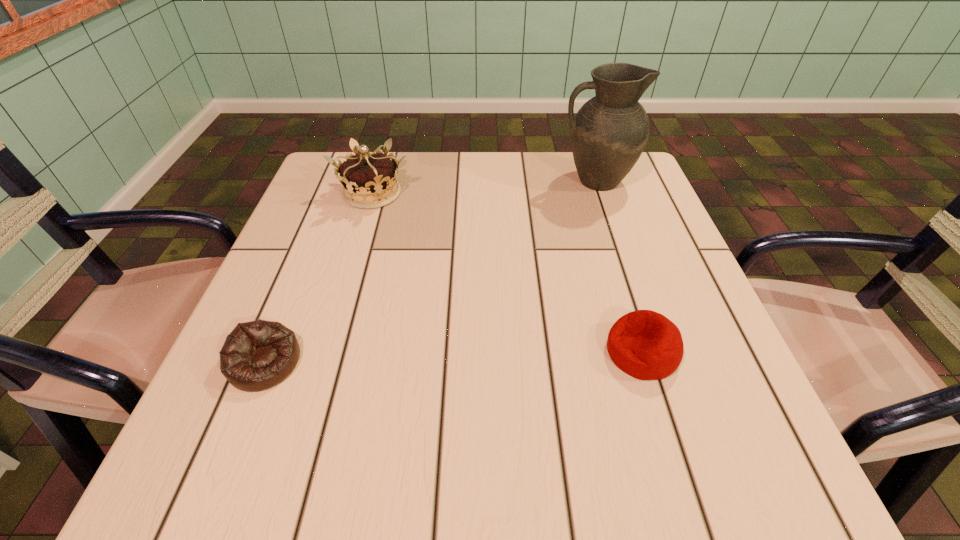
In order to click on vacant space located on the seat area of the taller beanbag in this screenshot , I will do `click(417, 352)`.

Locate an element on the screen. The width and height of the screenshot is (960, 540). free space located 0.320m on the seat area of the taller beanbag is located at coordinates (417, 352).

I want to click on vacant space located on the seat area of the taller beanbag, so click(404, 352).

The width and height of the screenshot is (960, 540). Find the location of `vacant space located 0.130m on the front of the shortest object`. vacant space located 0.130m on the front of the shortest object is located at coordinates (217, 480).

The width and height of the screenshot is (960, 540). In order to click on pitcher that is at the far edge in this screenshot , I will do `click(610, 131)`.

Where is `crown that is at the far edge`? This screenshot has width=960, height=540. crown that is at the far edge is located at coordinates (369, 180).

You are a GUI agent. You are given a task and a screenshot of the screen. Output one action in this format:
    pyautogui.click(x=<x>, y=<y>)
    Task: Click on the crown at the left edge
    This screenshot has width=960, height=540.
    Given the screenshot: What is the action you would take?
    pyautogui.click(x=369, y=180)

At what (x,y) coordinates should I click in order to perform the action: click on beanbag that is at the left edge. Please return your answer as a coordinate pair (x, y). This screenshot has height=540, width=960. Looking at the image, I should click on (257, 355).

You are a GUI agent. You are given a task and a screenshot of the screen. Output one action in this format:
    pyautogui.click(x=<x>, y=<y>)
    Task: Click on the pitcher that is at the right edge
    The image size is (960, 540).
    Given the screenshot: What is the action you would take?
    pyautogui.click(x=610, y=131)

Image resolution: width=960 pixels, height=540 pixels. What are the coordinates of `beanbag at the right edge` in the screenshot? It's located at (646, 345).